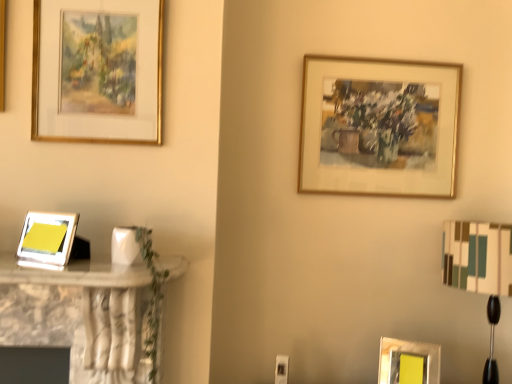
The height and width of the screenshot is (384, 512). What do you see at coordinates (97, 71) in the screenshot?
I see `gold-framed painting at upper left, the fourth picture frame in the bottom-to-top sequence` at bounding box center [97, 71].

Identify the location of gold-framed painting at upper left, which appears as the second picture frame when viewed from the front. The width and height of the screenshot is (512, 384). (97, 71).

Where is `gold-framed painting at upper left, marked as the third picture frame in a back-to-front arrangement`? The width and height of the screenshot is (512, 384). gold-framed painting at upper left, marked as the third picture frame in a back-to-front arrangement is located at coordinates (97, 71).

Does point (149, 71) appear closer or farther from the camera than point (488, 287)?

Point (149, 71) is positioned closer to the camera compared to point (488, 287).

From a real-world perspective, who is located higher, gold-framed painting at upper left, which appears as the second picture frame when viewed from the front, or white fabric lampshade at right?

From a 3D spatial view, gold-framed painting at upper left, which appears as the second picture frame when viewed from the front, is above.

Is gold-framed painting at upper left, which appears as the second picture frame when viewed from the front, further to the viewer compared to white fabric lampshade at right?

No.

Considering the positions of objects gold-framed painting at upper left, which is the third picture frame in right-to-left order, and white fabric lampshade at right in the image provided, who is more to the right, gold-framed painting at upper left, which is the third picture frame in right-to-left order, or white fabric lampshade at right?

white fabric lampshade at right.

From the image's perspective, between matte silver picture frame at left, acting as the 1th picture frame starting from the front, and gold-framed painting at upper left, marked as the third picture frame in a back-to-front arrangement, who is located below?

matte silver picture frame at left, acting as the 1th picture frame starting from the front, appears lower in the image.

Looking at this image, which object is more forward, matte silver picture frame at left, acting as the 1th picture frame starting from the front, or gold-framed painting at upper left, the 1th picture frame from the top?

matte silver picture frame at left, acting as the 1th picture frame starting from the front.

Is matte silver picture frame at left, the 2th picture frame ordered from the bottom, thinner than gold-framed painting at upper left, which appears as the second picture frame when viewed from the front?

No, matte silver picture frame at left, the 2th picture frame ordered from the bottom, is not thinner than gold-framed painting at upper left, which appears as the second picture frame when viewed from the front.

Is matte silver picture frame at left, which is the 4th picture frame in right-to-left order, surrounding gold-framed painting at upper left, which appears as the second picture frame when viewed from the front?

Definitely not — gold-framed painting at upper left, which appears as the second picture frame when viewed from the front, is not inside matte silver picture frame at left, which is the 4th picture frame in right-to-left order.

Based on the photo, from the image's perspective, which one is positioned lower, gold metallic picture frame at upper right, which is the 1th picture frame from back to front, or matte silver picture frame at lower right, the third picture frame positioned from the front?

From the image's view, matte silver picture frame at lower right, the third picture frame positioned from the front, is below.

Identify the location of picture frame that is the 2nd object directly below the gold metallic picture frame at upper right, placed as the second picture frame when sorted from right to left (from a real-world perspective). This screenshot has height=384, width=512. pos(408,362).

Is gold metallic picture frame at upper right, which is the 1th picture frame from back to front, not within matte silver picture frame at lower right, the third picture frame positioned from the front?

Yes, gold metallic picture frame at upper right, which is the 1th picture frame from back to front, is not within matte silver picture frame at lower right, the third picture frame positioned from the front.

Would you say white fabric lampshade at right is a long distance from gold metallic picture frame at upper right, the third picture frame from the bottom?

Actually, white fabric lampshade at right and gold metallic picture frame at upper right, the third picture frame from the bottom, are a little close together.

Is white fabric lampshade at right turned away from gold metallic picture frame at upper right, which is the 1th picture frame from back to front?

No, white fabric lampshade at right is not facing away from gold metallic picture frame at upper right, which is the 1th picture frame from back to front.

Image resolution: width=512 pixels, height=384 pixels. Find the location of `the 2nd picture frame positioned above the white fabric lampshade at right (from the image's perspective)`. the 2nd picture frame positioned above the white fabric lampshade at right (from the image's perspective) is located at coordinates (379, 127).

Who is bigger, white fabric lampshade at right or matte silver picture frame at left, which appears as the fourth picture frame when viewed from the back?

white fabric lampshade at right is bigger.

How different are the orientations of white fabric lampshade at right and matte silver picture frame at left, which is the 4th picture frame in right-to-left order, in degrees?

They differ by 23.9 degrees in their facing directions.

From the image's perspective, is white fabric lampshade at right over matte silver picture frame at left, which is the 4th picture frame in right-to-left order?

No.

From the picture: How distant is white fabric lampshade at right from matte silver picture frame at left, acting as the third picture frame starting from the top?

The distance of white fabric lampshade at right from matte silver picture frame at left, acting as the third picture frame starting from the top, is 1.33 meters.

Between white fabric lampshade at right and gold-framed painting at upper left, the fourth picture frame in the bottom-to-top sequence, which one has smaller width?

With smaller width is gold-framed painting at upper left, the fourth picture frame in the bottom-to-top sequence.

Find the location of a particular element. table lamp below the gold-framed painting at upper left, which appears as the second picture frame when viewed from the front (from a real-world perspective) is located at coordinates (480, 269).

In the image, is white fabric lampshade at right on the left side or the right side of gold-framed painting at upper left, the fourth picture frame in the bottom-to-top sequence?

Based on their positions, white fabric lampshade at right is located to the right of gold-framed painting at upper left, the fourth picture frame in the bottom-to-top sequence.

Can you tell me how much white fabric lampshade at right and gold-framed painting at upper left, which is the third picture frame in right-to-left order, differ in facing direction?

1 degrees separate the facing orientations of white fabric lampshade at right and gold-framed painting at upper left, which is the third picture frame in right-to-left order.

Does gold metallic picture frame at upper right, the 3th picture frame viewed from the left, have a lesser width compared to matte silver picture frame at left, the 2th picture frame ordered from the bottom?

Yes, gold metallic picture frame at upper right, the 3th picture frame viewed from the left, is thinner than matte silver picture frame at left, the 2th picture frame ordered from the bottom.

Which object is further away from the camera, gold metallic picture frame at upper right, placed as the second picture frame when sorted from right to left, or matte silver picture frame at left, which is the 4th picture frame in right-to-left order?

gold metallic picture frame at upper right, placed as the second picture frame when sorted from right to left, is further from the camera.

Who is shorter, gold metallic picture frame at upper right, placed as the second picture frame when sorted from right to left, or matte silver picture frame at left, acting as the 1th picture frame starting from the front?

matte silver picture frame at left, acting as the 1th picture frame starting from the front.

Is gold metallic picture frame at upper right, placed as the second picture frame when sorted from right to left, touching matte silver picture frame at left, which is the 4th picture frame in right-to-left order?

gold metallic picture frame at upper right, placed as the second picture frame when sorted from right to left, and matte silver picture frame at left, which is the 4th picture frame in right-to-left order, are clearly separated.

The height and width of the screenshot is (384, 512). I want to click on the 3rd picture frame counting from the left of the white fabric lampshade at right, so click(97, 71).

From a real-world perspective, count 2nd picture frames upward from the matte silver picture frame at left, which appears as the fourth picture frame when viewed from the back, and point to it. Please provide its 2D coordinates.

[(97, 71)]

Based on their spatial positions, is gold metallic picture frame at upper right, the third picture frame from the bottom, or matte silver picture frame at left, the first picture frame viewed from the left, further from gold-framed painting at upper left, which is the third picture frame in right-to-left order?

gold metallic picture frame at upper right, the third picture frame from the bottom, is positioned further to the anchor gold-framed painting at upper left, which is the third picture frame in right-to-left order.

Which object lies further to the anchor point matte silver picture frame at lower right, the third picture frame positioned from the front, gold-framed painting at upper left, which is the third picture frame in right-to-left order, or matte silver picture frame at left, the first picture frame viewed from the left?

gold-framed painting at upper left, which is the third picture frame in right-to-left order, is further to matte silver picture frame at lower right, the third picture frame positioned from the front.

Looking at this image, looking at the image, which one is located closer to white fabric lampshade at right, matte silver picture frame at lower right, placed as the 1th picture frame when sorted from right to left, or matte silver picture frame at left, which is the 4th picture frame in right-to-left order?

The object closer to white fabric lampshade at right is matte silver picture frame at lower right, placed as the 1th picture frame when sorted from right to left.

Which object lies further to the anchor point white fabric lampshade at right, gold-framed painting at upper left, the second picture frame viewed from the left, or matte silver picture frame at left, the first picture frame viewed from the left?

Based on the image, matte silver picture frame at left, the first picture frame viewed from the left, appears to be further to white fabric lampshade at right.

Looking at the image, which one is located further to matte silver picture frame at lower right, the third picture frame positioned from the front, white fabric lampshade at right or matte silver picture frame at left, which appears as the fourth picture frame when viewed from the back?

matte silver picture frame at left, which appears as the fourth picture frame when viewed from the back, lies further to matte silver picture frame at lower right, the third picture frame positioned from the front, than the other object.

Looking at the image, which one is located closer to gold metallic picture frame at upper right, the 4th picture frame from the front, matte silver picture frame at left, the first picture frame viewed from the left, or white fabric lampshade at right?

The object closer to gold metallic picture frame at upper right, the 4th picture frame from the front, is white fabric lampshade at right.

Which object lies further to the anchor point gold metallic picture frame at upper right, placed as the second picture frame when sorted from right to left, white fabric lampshade at right or matte silver picture frame at lower right, placed as the 1th picture frame when sorted from right to left?

The object further to gold metallic picture frame at upper right, placed as the second picture frame when sorted from right to left, is matte silver picture frame at lower right, placed as the 1th picture frame when sorted from right to left.

Considering their positions, is matte silver picture frame at lower right, arranged as the 4th picture frame when viewed from the left, positioned closer to gold metallic picture frame at upper right, which is counted as the second picture frame, starting from the top, than matte silver picture frame at left, acting as the 1th picture frame starting from the front?

matte silver picture frame at lower right, arranged as the 4th picture frame when viewed from the left.

Where is `table lamp between gold metallic picture frame at upper right, the third picture frame from the bottom, and matte silver picture frame at lower right, arranged as the 4th picture frame when viewed from the left, from top to bottom`? This screenshot has width=512, height=384. table lamp between gold metallic picture frame at upper right, the third picture frame from the bottom, and matte silver picture frame at lower right, arranged as the 4th picture frame when viewed from the left, from top to bottom is located at coordinates (480, 269).

At what (x,y) coordinates should I click in order to perform the action: click on picture frame situated between matte silver picture frame at left, acting as the third picture frame starting from the top, and gold metallic picture frame at upper right, which is the 1th picture frame from back to front, from left to right. Please return your answer as a coordinate pair (x, y). The image size is (512, 384). Looking at the image, I should click on (97, 71).

Locate an element on the screen. The image size is (512, 384). picture frame between gold-framed painting at upper left, the 1th picture frame from the top, and matte silver picture frame at lower right, arranged as the 4th picture frame when viewed from the left is located at coordinates (379, 127).